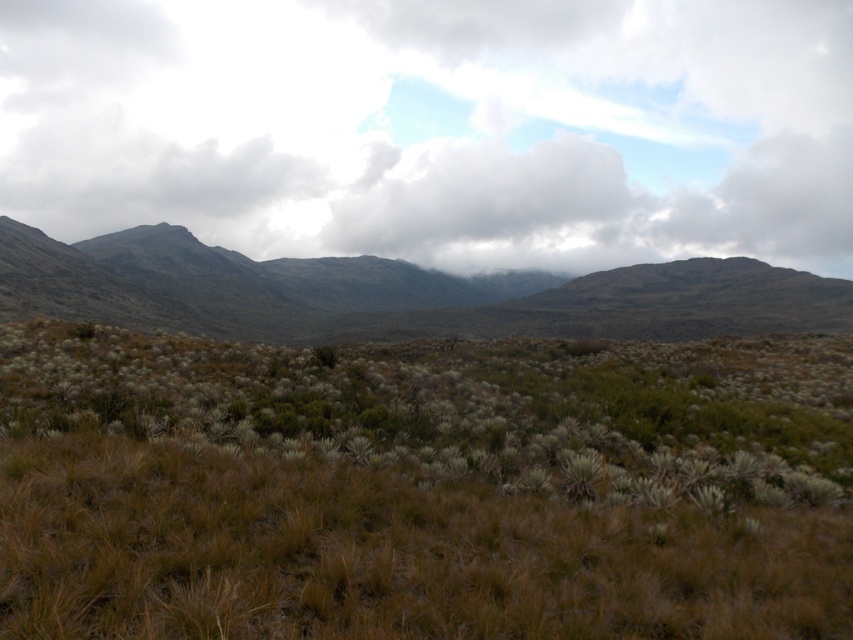
Who is positioned more to the right, brown grassland at center or dark gray rocky mountains at center?

Positioned to the right is brown grassland at center.

Who is higher up, brown grassland at center or dark gray rocky mountains at center?

dark gray rocky mountains at center

Which is behind, point (846, 532) or point (265, 324)?

The point (265, 324) is behind.

Where is `brown grassland at center`? brown grassland at center is located at coordinates (422, 488).

Between cloudy sky at upper center and dark gray rocky mountains at center, which one has more height?

cloudy sky at upper center is taller.

Who is shorter, cloudy sky at upper center or dark gray rocky mountains at center?

dark gray rocky mountains at center

This screenshot has width=853, height=640. I want to click on cloudy sky at upper center, so click(438, 129).

Is point (543, 637) less distant than point (292, 177)?

That is True.

Is point (761, 572) closer to viewer compared to point (660, 184)?

Yes.

The width and height of the screenshot is (853, 640). Find the location of `brown grassland at center`. brown grassland at center is located at coordinates coord(422,488).